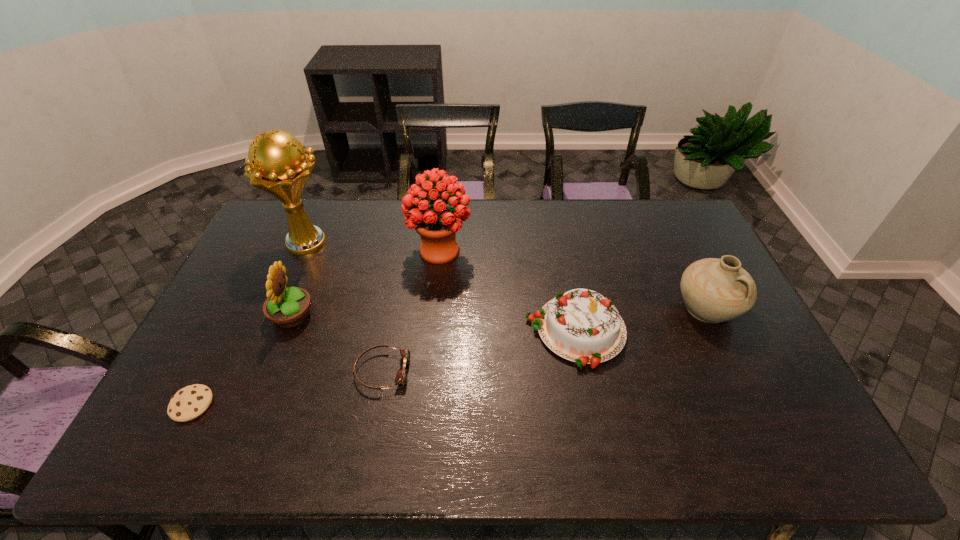
This screenshot has height=540, width=960. Find the location of `free space located on the face of the sunflower`. free space located on the face of the sunflower is located at coordinates (381, 316).

Identify the location of free space located 0.280m on the back of the rightmost object. The image size is (960, 540). (669, 230).

This screenshot has height=540, width=960. In order to click on vacant area situated 0.050m on the front of the sixth object from left to right in this screenshot , I will do `click(587, 388)`.

Find the location of `vacant region located through the lenses of the goggles`. vacant region located through the lenses of the goggles is located at coordinates (516, 371).

You are a GUI agent. You are given a task and a screenshot of the screen. Output one action in this format:
    pyautogui.click(x=<x>, y=<y>)
    Task: Click on the blank area located 0.260m on the right of the cookie
    The image size is (960, 540).
    Given the screenshot: What is the action you would take?
    pyautogui.click(x=315, y=404)

Where is `trophy_cup at the far edge`? The width and height of the screenshot is (960, 540). trophy_cup at the far edge is located at coordinates (276, 163).

Where is `bouquet present at the far edge`? This screenshot has width=960, height=540. bouquet present at the far edge is located at coordinates (437, 224).

Where is `trophy_cup located in the left edge section of the desktop`? trophy_cup located in the left edge section of the desktop is located at coordinates (276, 163).

Locate an element on the screen. cookie at the left edge is located at coordinates (190, 402).

In order to click on object located in the right edge section of the desktop in this screenshot , I will do `click(714, 290)`.